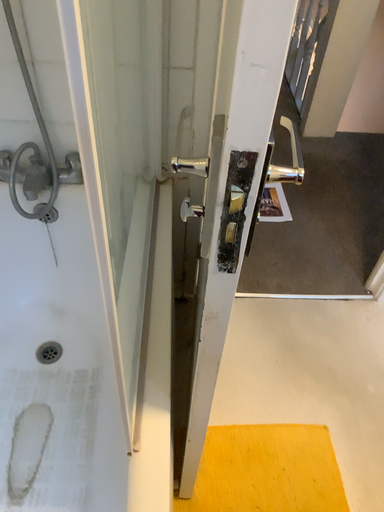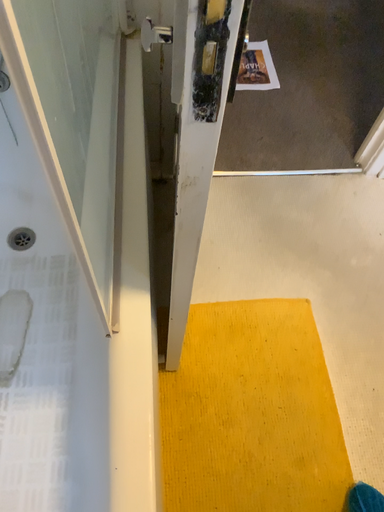
Question: How did the camera likely rotate when shooting the video?

Choices:
 (A) rotated downward
 (B) rotated upward

Answer: (A)